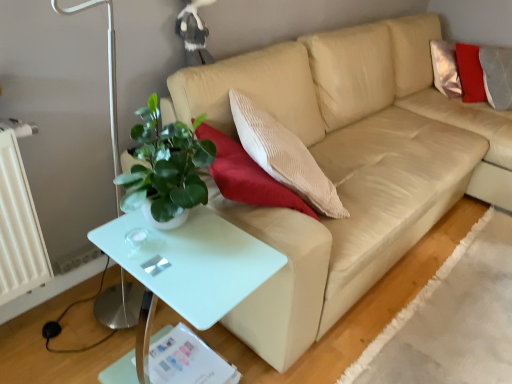
The width and height of the screenshot is (512, 384). I want to click on white glossy table at lower left, so click(x=191, y=262).

What do you see at coordinates (191, 262) in the screenshot? The width and height of the screenshot is (512, 384). I see `white glossy table at lower left` at bounding box center [191, 262].

At what (x,y) coordinates should I click in order to perform the action: click on beige leather couch at center. Please return your answer as a coordinate pair (x, y). This screenshot has width=512, height=384. Looking at the image, I should click on (348, 165).

Describe the element at coordinates (348, 165) in the screenshot. The image size is (512, 384). I see `beige leather couch at center` at that location.

The height and width of the screenshot is (384, 512). I want to click on white glossy table at lower left, so click(x=191, y=262).

Can you confirm if beige leather couch at center is positioned to the left of white glossy table at lower left?

In fact, beige leather couch at center is to the right of white glossy table at lower left.

Which object is closer to the camera taking this photo, beige leather couch at center or white glossy table at lower left?

white glossy table at lower left.

Is point (426, 179) closer to viewer compared to point (122, 233)?

No, it is not.

From the image's perspective, is beige leather couch at center on top of white glossy table at lower left?

Indeed, from the image's perspective, beige leather couch at center is shown above white glossy table at lower left.

From a real-world perspective, which is physically above, beige leather couch at center or white glossy table at lower left?

From a 3D spatial view, beige leather couch at center is above.

Looking at their sizes, would you say beige leather couch at center is wider or thinner than white glossy table at lower left?

Clearly, beige leather couch at center has more width compared to white glossy table at lower left.

Does beige leather couch at center have a greater height compared to white glossy table at lower left?

Yes.

Can you confirm if beige leather couch at center is bigger than white glossy table at lower left?

Yes, beige leather couch at center is bigger than white glossy table at lower left.

Does beige leather couch at center contain white glossy table at lower left?

Definitely not — white glossy table at lower left is not inside beige leather couch at center.

Looking at this image, can you see beige leather couch at center touching white glossy table at lower left?

There is a gap between beige leather couch at center and white glossy table at lower left.

Is beige leather couch at center oriented away from white glossy table at lower left?

No, beige leather couch at center's orientation is not away from white glossy table at lower left.

What's the angular difference between beige leather couch at center and white glossy table at lower left's facing directions?

0.553 degrees.

How far apart are beige leather couch at center and white glossy table at lower left?

They are 25.03 inches apart.

You are a GUI agent. You are given a task and a screenshot of the screen. Output one action in this format:
    pyautogui.click(x=<x>, y=<y>)
    Task: Click on the table that appears below the beige leather couch at center (from the image's perspective)
    The height and width of the screenshot is (384, 512).
    Given the screenshot: What is the action you would take?
    pyautogui.click(x=191, y=262)

Does white glossy table at lower left appear on the left side of beige leather couch at center?

Yes, white glossy table at lower left is to the left of beige leather couch at center.

Between white glossy table at lower left and beige leather couch at center, which one is positioned in front?

white glossy table at lower left is closer to the camera.

Between point (182, 315) and point (498, 120), which one is positioned in front?

Positioned in front is point (182, 315).

From the image's perspective, is white glossy table at lower left positioned above or below beige leather couch at center?

white glossy table at lower left is below beige leather couch at center.

From a real-world perspective, is white glossy table at lower left physically located above or below beige leather couch at center?

From a real-world perspective, white glossy table at lower left is physically below beige leather couch at center.

Between white glossy table at lower left and beige leather couch at center, which one has larger width?

beige leather couch at center is wider.

In the scene shown: Considering the sizes of objects white glossy table at lower left and beige leather couch at center in the image provided, who is shorter, white glossy table at lower left or beige leather couch at center?

Standing shorter between the two is white glossy table at lower left.

Is white glossy table at lower left bigger or smaller than beige leather couch at center?

Considering their sizes, white glossy table at lower left takes up less space than beige leather couch at center.

Is white glossy table at lower left completely or partially outside of beige leather couch at center?

white glossy table at lower left is positioned outside beige leather couch at center.

Is white glossy table at lower left in contact with beige leather couch at center?

No, white glossy table at lower left is not beside beige leather couch at center.

Is white glossy table at lower left oriented away from beige leather couch at center?

No, beige leather couch at center is not at the back of white glossy table at lower left.

How many degrees apart are the facing directions of white glossy table at lower left and beige leather couch at center?

The angle between the facing direction of white glossy table at lower left and the facing direction of beige leather couch at center is 0.553 degrees.

Find the location of a particular element. table in front of the beige leather couch at center is located at coordinates (191, 262).

The height and width of the screenshot is (384, 512). In the image, there is a beige leather couch at center. Find the location of `table below it (from the image's perspective)`. table below it (from the image's perspective) is located at coordinates (191, 262).

The image size is (512, 384). Find the location of `table on the left side of beige leather couch at center`. table on the left side of beige leather couch at center is located at coordinates [191, 262].